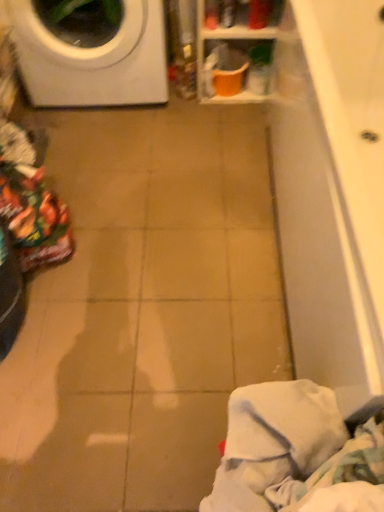
Where is `orange plastic bucket at upper center`? orange plastic bucket at upper center is located at coordinates (253, 46).

Identify the location of white glossy washing machine at upper left. (91, 53).

From a real-world perspective, is white glossy washing machine at upper left on top of orange plastic bucket at upper center?

Yes, from a real-world perspective, white glossy washing machine at upper left is above orange plastic bucket at upper center.

Identify the location of washing machine located above the orange plastic bucket at upper center (from the image's perspective). The height and width of the screenshot is (512, 384). (91, 53).

Which of these two, white glossy washing machine at upper left or orange plastic bucket at upper center, stands shorter?

orange plastic bucket at upper center is shorter.

From the picture: Which object is positioned more to the right, white glossy washing machine at upper left or orange plastic bucket at upper center?

orange plastic bucket at upper center.

In terms of height, does white glossy washing machine at upper left look taller or shorter compared to white soft cloth at lower right?

In the image, white glossy washing machine at upper left appears to be taller than white soft cloth at lower right.

Where is `clothing located below the white glossy washing machine at upper left (from the image's perspective)`? The width and height of the screenshot is (384, 512). clothing located below the white glossy washing machine at upper left (from the image's perspective) is located at coordinates pos(296,454).

Who is smaller, white glossy washing machine at upper left or white soft cloth at lower right?

Smaller between the two is white soft cloth at lower right.

Is white glossy washing machine at upper left aimed at white soft cloth at lower right?

Yes, white glossy washing machine at upper left is turned towards white soft cloth at lower right.

From the picture: Is white soft cloth at lower right smaller than orange plastic bucket at upper center?

Correct, white soft cloth at lower right occupies less space than orange plastic bucket at upper center.

Considering the relative positions of white soft cloth at lower right and orange plastic bucket at upper center in the image provided, is white soft cloth at lower right to the right of orange plastic bucket at upper center from the viewer's perspective?

No, white soft cloth at lower right is not to the right of orange plastic bucket at upper center.

Is orange plastic bucket at upper center at the back of white soft cloth at lower right?

That's not correct — white soft cloth at lower right is not looking away from orange plastic bucket at upper center.

Based on the photo, does white soft cloth at lower right have a lesser width compared to white glossy washing machine at upper left?

Correct, the width of white soft cloth at lower right is less than that of white glossy washing machine at upper left.

Is white soft cloth at lower right situated inside white glossy washing machine at upper left or outside?

white soft cloth at lower right exists outside the volume of white glossy washing machine at upper left.

Does point (288, 388) appear closer or farther from the camera than point (11, 23)?

Point (288, 388) is positioned closer to the camera compared to point (11, 23).

From a real-world perspective, which is physically above, white soft cloth at lower right or white glossy washing machine at upper left?

white soft cloth at lower right is physically above.

Considering the sizes of objects orange plastic bucket at upper center and white soft cloth at lower right in the image provided, who is taller, orange plastic bucket at upper center or white soft cloth at lower right?

orange plastic bucket at upper center.

Where is `shelf that appears above the white soft cloth at lower right (from the image's perspective)`? shelf that appears above the white soft cloth at lower right (from the image's perspective) is located at coordinates (253, 46).

From a real-world perspective, between orange plastic bucket at upper center and white soft cloth at lower right, who is vertically lower?

orange plastic bucket at upper center, from a real-world perspective.

From a real-world perspective, relative to white glossy washing machine at upper left, is orange plastic bucket at upper center vertically above or below?

Clearly, from a real-world perspective, orange plastic bucket at upper center is below white glossy washing machine at upper left.

From the image's perspective, is orange plastic bucket at upper center under white glossy washing machine at upper left?

Yes, from the image's perspective, orange plastic bucket at upper center is below white glossy washing machine at upper left.

Could you tell me if orange plastic bucket at upper center is turned towards white glossy washing machine at upper left?

No, orange plastic bucket at upper center does not turn towards white glossy washing machine at upper left.

Where is `shelf below the white glossy washing machine at upper left (from a real-world perspective)`? This screenshot has height=512, width=384. shelf below the white glossy washing machine at upper left (from a real-world perspective) is located at coordinates (253, 46).

At what (x,y) coordinates should I click in order to perform the action: click on washing machine positioned vertically above the orange plastic bucket at upper center (from a real-world perspective). Please return your answer as a coordinate pair (x, y). The width and height of the screenshot is (384, 512). Looking at the image, I should click on (91, 53).

This screenshot has width=384, height=512. I want to click on clothing on the right of white glossy washing machine at upper left, so click(x=296, y=454).

Estimate the real-world distances between objects in this image. Which object is closer to orange plastic bucket at upper center, white glossy washing machine at upper left or white soft cloth at lower right?

The object closer to orange plastic bucket at upper center is white glossy washing machine at upper left.

From the image, which object appears to be farther from white soft cloth at lower right, orange plastic bucket at upper center or white glossy washing machine at upper left?

white glossy washing machine at upper left is positioned further to the anchor white soft cloth at lower right.

Based on their spatial positions, is white soft cloth at lower right or white glossy washing machine at upper left closer to orange plastic bucket at upper center?

The object closer to orange plastic bucket at upper center is white glossy washing machine at upper left.

Considering their positions, is white soft cloth at lower right positioned further to white glossy washing machine at upper left than orange plastic bucket at upper center?

white soft cloth at lower right.

Based on their spatial positions, is orange plastic bucket at upper center or white soft cloth at lower right further from white glossy washing machine at upper left?

The object further to white glossy washing machine at upper left is white soft cloth at lower right.

Based on their spatial positions, is white glossy washing machine at upper left or orange plastic bucket at upper center closer to white soft cloth at lower right?

orange plastic bucket at upper center is closer to white soft cloth at lower right.

Identify the location of shelf between white glossy washing machine at upper left and white soft cloth at lower right from top to bottom. The image size is (384, 512). (253, 46).